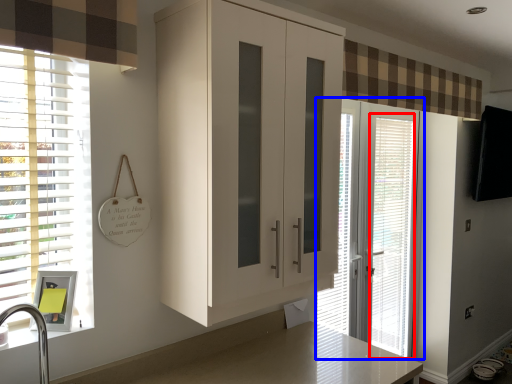
Question: Which of the following is the farthest to the observer, blind (highlighted by a red box) or door (highlighted by a blue box)?

Choices:
 (A) blind
 (B) door

Answer: (A)